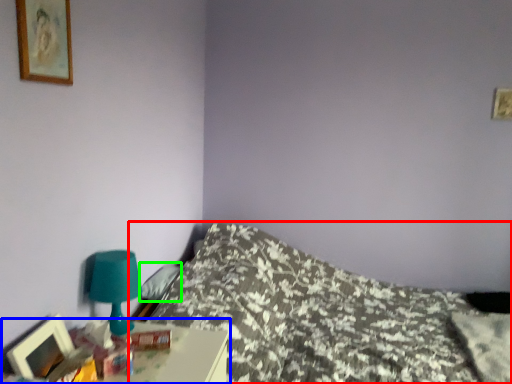
Question: Estimate the real-world distances between objects in this image. Which object is closer to bed (highlighted by a red box), nightstand (highlighted by a blue box) or pillow (highlighted by a green box)?

Choices:
 (A) nightstand
 (B) pillow

Answer: (B)